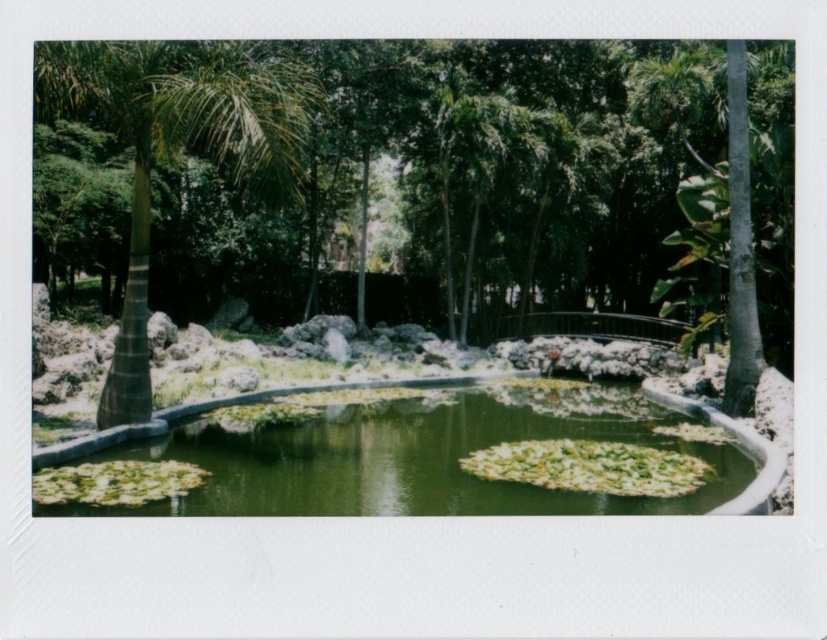
You are standing at the entrance of the garden and see the green leafy tree at center and the green mossy pond at center. Which object is positioned to the left when looking towards the center of the garden?

The green leafy tree at center is positioned to the left of the green mossy pond at center.

You are standing at the entrance of the garden and see the point marked as point (443, 184). What is the object located at this point?

The point (443, 184) corresponds to the green leafy tree at center.

You are standing in the garden and want to reach the point marked as point (130, 468). The path is 7 meters long. Can you walk directly to that point without needing to go around?

The distance between you and point (130, 468) is 7.31 meters, which is slightly longer than the 7 meter path. Therefore, you may need to adjust your route or take a slightly longer path to reach it.